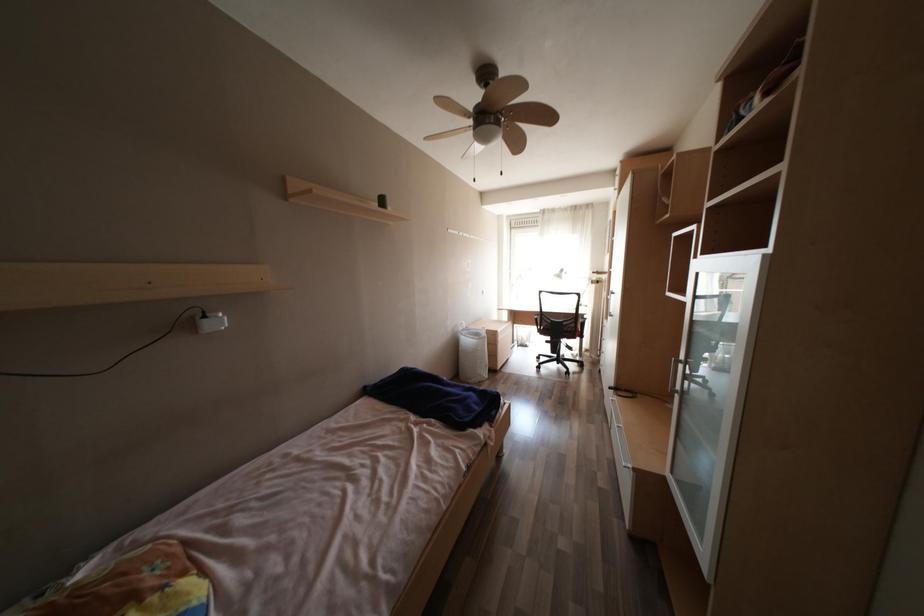
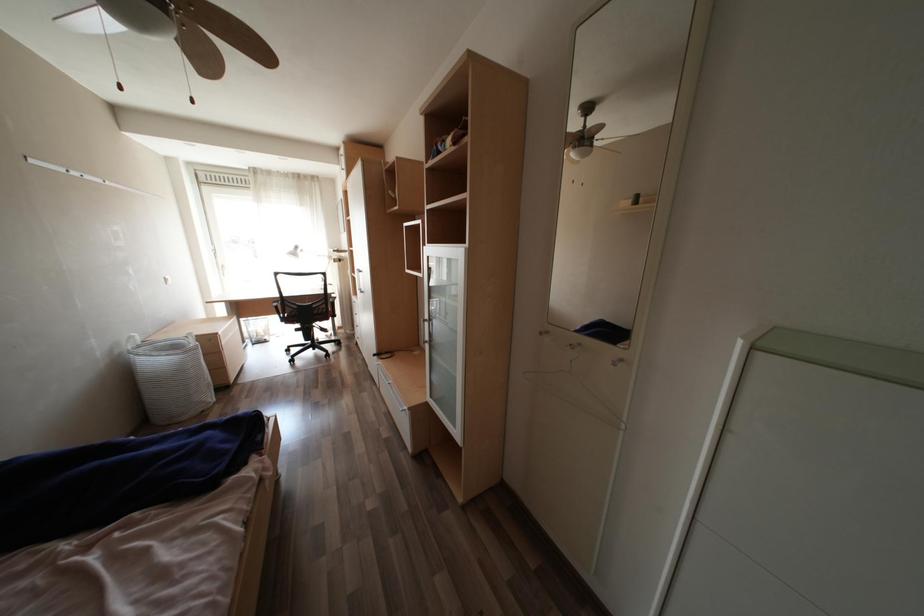
Question: The camera is either moving clockwise (left) or counter-clockwise (right) around the object. The first image is from the beginning of the video and the second image is from the end. Is the camera moving left or right when shooting the video?

Choices:
 (A) Left
 (B) Right

Answer: (A)